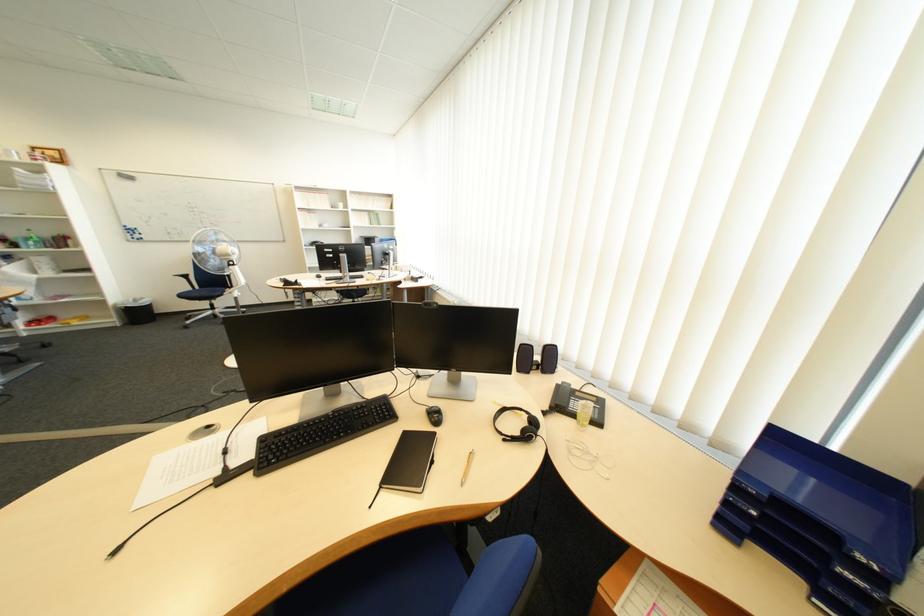
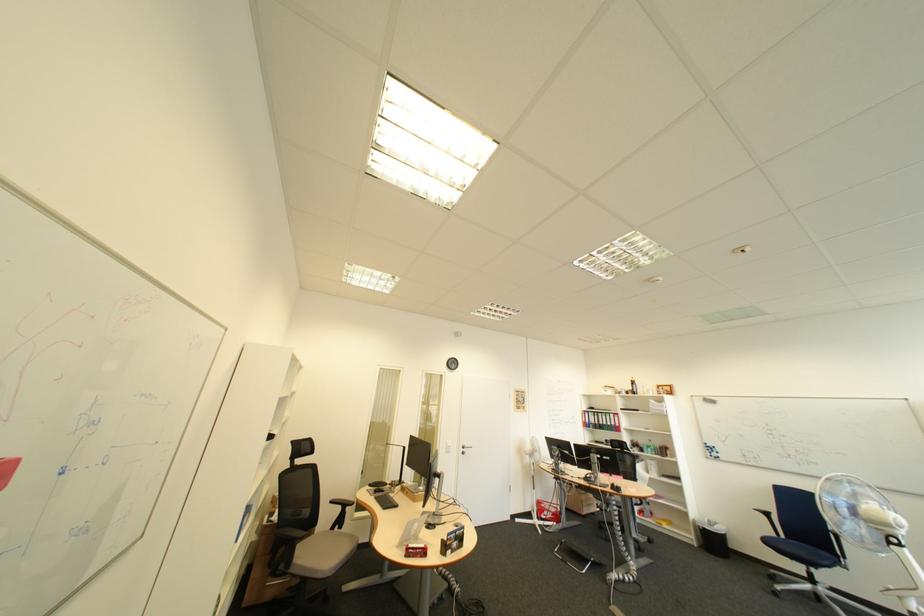
How did the camera likely rotate?

The rotation direction of the camera is left-up.